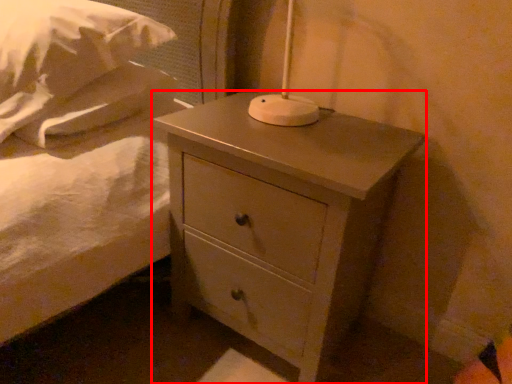
Question: From the image, what is the correct spatial relationship of nightstand (annotated by the red box) in relation to pillow?

Choices:
 (A) right
 (B) left

Answer: (A)